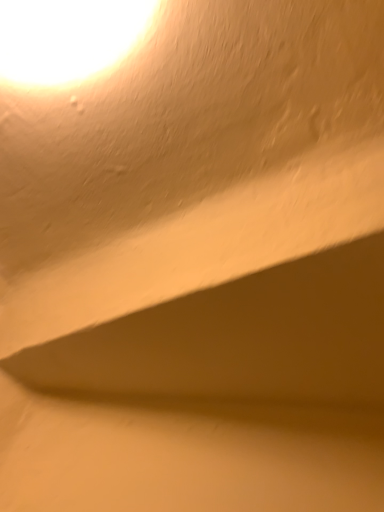
Find the location of a particular element. The width and height of the screenshot is (384, 512). matte yellow light at upper left is located at coordinates (67, 38).

Measure the distance between point (95, 36) and camera.

They are 48.80 centimeters apart.

Describe the element at coordinates (67, 38) in the screenshot. The width and height of the screenshot is (384, 512). I see `matte yellow light at upper left` at that location.

You are a GUI agent. You are given a task and a screenshot of the screen. Output one action in this format:
    pyautogui.click(x=<x>, y=<y>)
    Task: Click on the matte yellow light at upper left
    Image resolution: width=384 pixels, height=512 pixels.
    Given the screenshot: What is the action you would take?
    pyautogui.click(x=67, y=38)